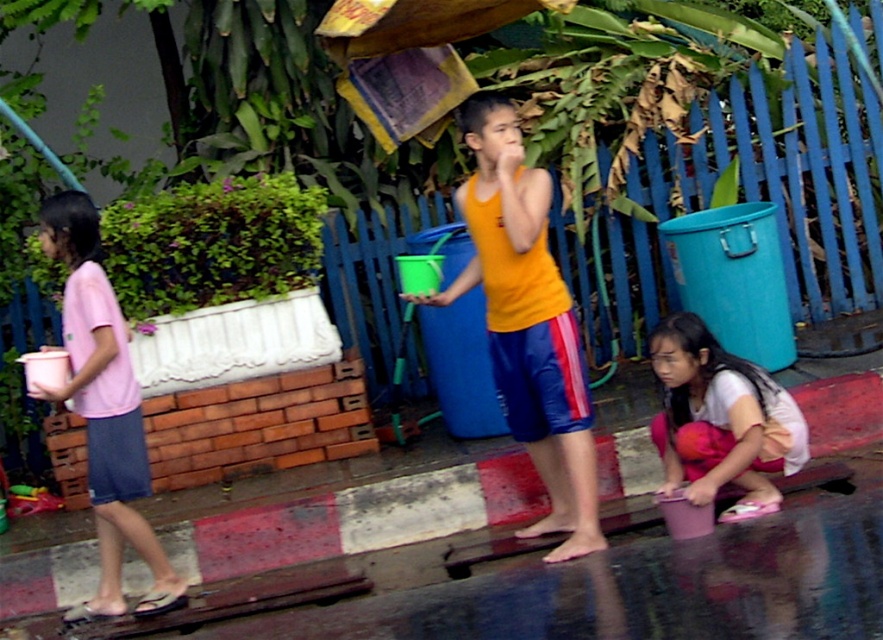
You are standing at the edge of the sidewalk and see the orange matte tank top at center. If you want to reach it without moving your feet, can you touch it?

The orange matte tank top at center is 16.28 feet away from the viewer, so you cannot touch it without moving your feet.

From the picture: You are standing at point (527,321) in the scene. What object is located exactly at this point?

The orange matte tank top at center is located exactly at point (527,321).